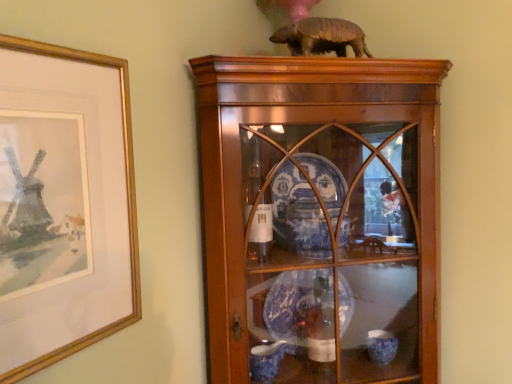
Image resolution: width=512 pixels, height=384 pixels. In order to click on wooden cabinet at center in this screenshot , I will do `click(320, 218)`.

What do you see at coordinates (322, 37) in the screenshot?
I see `brown matte armadillo at upper center` at bounding box center [322, 37].

Find the location of a particular element. wooden cabinet at center is located at coordinates (320, 218).

What's the angular difference between gold-framed picture at left and wooden cabinet at center's facing directions?

The facing directions of gold-framed picture at left and wooden cabinet at center are 46.7 degrees apart.

From a real-world perspective, who is located higher, gold-framed picture at left or wooden cabinet at center?

gold-framed picture at left is physically above.

Can you confirm if gold-framed picture at left is taller than wooden cabinet at center?

No, gold-framed picture at left is not taller than wooden cabinet at center.

From the image's perspective, is gold-framed picture at left located beneath wooden cabinet at center?

No, from the image's perspective, gold-framed picture at left is not beneath wooden cabinet at center.

Is the surface of wooden cabinet at center in direct contact with brown matte armadillo at upper center?

They are not placed beside each other.

Is wooden cabinet at center positioned in front of brown matte armadillo at upper center?

A: Yes.

Does brown matte armadillo at upper center have a greater width compared to wooden cabinet at center?

No.

Considering the relative sizes of brown matte armadillo at upper center and wooden cabinet at center in the image provided, is brown matte armadillo at upper center shorter than wooden cabinet at center?

Yes.

Would you say brown matte armadillo at upper center is a long distance from wooden cabinet at center?

That's not correct — brown matte armadillo at upper center is a little close to wooden cabinet at center.

Between brown matte armadillo at upper center and gold-framed picture at left, which one has larger size?

Bigger between the two is gold-framed picture at left.

Looking at this image, is the surface of brown matte armadillo at upper center in direct contact with gold-framed picture at left?

brown matte armadillo at upper center is not next to gold-framed picture at left, and they're not touching.

From a real-world perspective, is brown matte armadillo at upper center above or below gold-framed picture at left?

brown matte armadillo at upper center is situated higher than gold-framed picture at left in the real world.

From a real-world perspective, between wooden cabinet at center and gold-framed picture at left, who is vertically higher?

gold-framed picture at left is physically above.

Which object is further away from the camera, wooden cabinet at center or gold-framed picture at left?

wooden cabinet at center is behind.

Is wooden cabinet at center facing towards gold-framed picture at left?

No, wooden cabinet at center is not facing towards gold-framed picture at left.

From the picture: Which of these two, wooden cabinet at center or gold-framed picture at left, is wider?

With larger width is wooden cabinet at center.

Between gold-framed picture at left and brown matte armadillo at upper center, which one appears on the left side from the viewer's perspective?

gold-framed picture at left.

How many degrees apart are the facing directions of gold-framed picture at left and brown matte armadillo at upper center?

The angular difference between gold-framed picture at left and brown matte armadillo at upper center is 46.2 degrees.

From a real-world perspective, is gold-framed picture at left positioned under brown matte armadillo at upper center based on gravity?

Correct, in the physical world, gold-framed picture at left is lower than brown matte armadillo at upper center.

Is point (31, 342) closer or farther from the camera than point (305, 54)?

Clearly, point (31, 342) is closer to the camera than point (305, 54).

I want to click on shelf on the right side of gold-framed picture at left, so click(320, 218).

Identify the location of animal on the left of wooden cabinet at center. (322, 37).

Considering their positions, is brown matte armadillo at upper center positioned closer to wooden cabinet at center than gold-framed picture at left?

brown matte armadillo at upper center is closer to wooden cabinet at center.

Which object lies further to the anchor point brown matte armadillo at upper center, gold-framed picture at left or wooden cabinet at center?

gold-framed picture at left lies further to brown matte armadillo at upper center than the other object.

From the image, which object appears to be farther from gold-framed picture at left, wooden cabinet at center or brown matte armadillo at upper center?

Based on the image, brown matte armadillo at upper center appears to be further to gold-framed picture at left.

Looking at the image, which one is located further to brown matte armadillo at upper center, wooden cabinet at center or gold-framed picture at left?

gold-framed picture at left is further to brown matte armadillo at upper center.

Estimate the real-world distances between objects in this image. Which object is further from wooden cabinet at center, gold-framed picture at left or brown matte armadillo at upper center?

gold-framed picture at left lies further to wooden cabinet at center than the other object.

Which object lies further to the anchor point gold-framed picture at left, brown matte armadillo at upper center or wooden cabinet at center?

brown matte armadillo at upper center is positioned further to the anchor gold-framed picture at left.

Find the location of a particular element. picture frame between brown matte armadillo at upper center and wooden cabinet at center in the vertical direction is located at coordinates (63, 204).